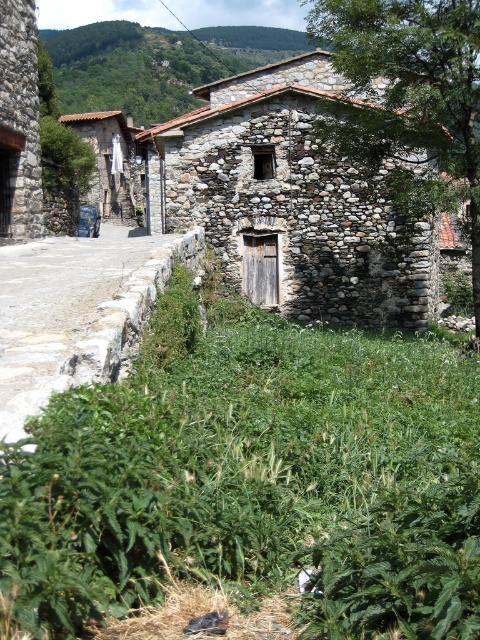
Question: Can you confirm if green leafy grass at center is positioned to the right of green leafy tree at center?

Choices:
 (A) yes
 (B) no

Answer: (B)

Question: In this image, where is green leafy grass at center located relative to green leafy tree at center?

Choices:
 (A) right
 (B) left

Answer: (B)

Question: Among these points, which one is nearest to the camera?

Choices:
 (A) [x=363, y=595]
 (B) [x=444, y=128]

Answer: (A)

Question: Is green leafy grass at center above green leafy tree at center?

Choices:
 (A) no
 (B) yes

Answer: (A)

Question: Which point is farther to the camera?

Choices:
 (A) green leafy tree at center
 (B) green leafy grass at center

Answer: (A)

Question: Which of the following is the closest to the observer?

Choices:
 (A) green leafy tree at center
 (B) green leafy grass at center

Answer: (B)